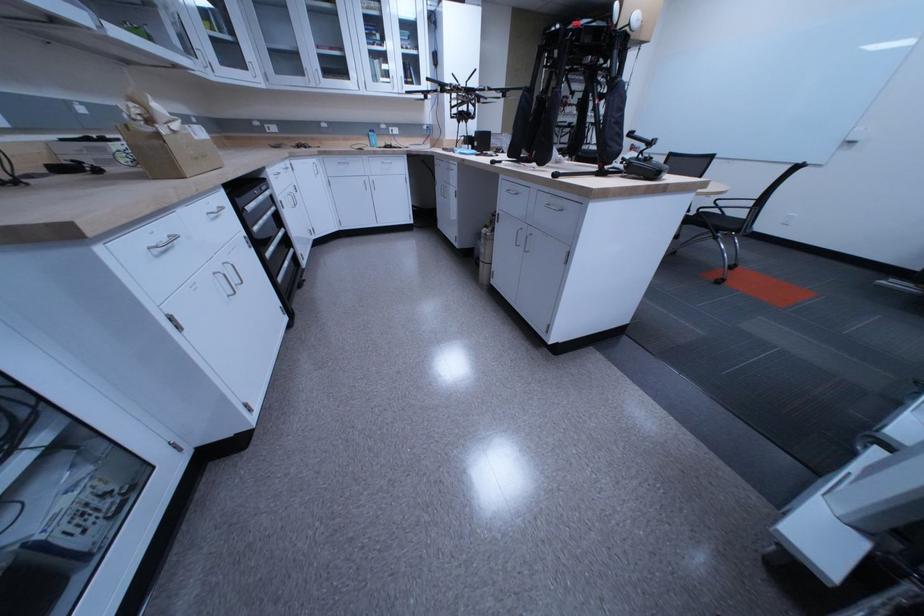
The image size is (924, 616). Identify the location of canister valve. (163, 244).